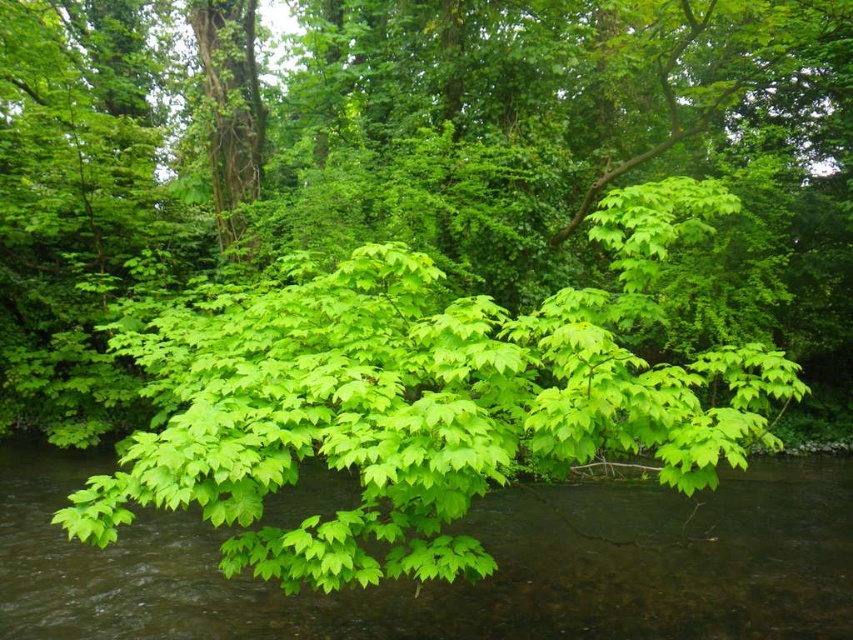
Question: Is the position of green leafy tree at center less distant than that of green matte leaf at center?

Choices:
 (A) no
 (B) yes

Answer: (A)

Question: Among these objects, which one is nearest to the camera?

Choices:
 (A) green matte leaf at center
 (B) green leafy branches at center
 (C) green leafy tree at center

Answer: (A)

Question: Considering the relative positions of green leafy tree at center and green leafy branches at center in the image provided, where is green leafy tree at center located with respect to green leafy branches at center?

Choices:
 (A) above
 (B) below

Answer: (A)

Question: Which point is closer to the camera?

Choices:
 (A) green leafy tree at center
 (B) green matte leaf at center
 (C) green leafy branches at center

Answer: (B)

Question: Based on their relative distances, which object is farther from the green leafy tree at center?

Choices:
 (A) green matte leaf at center
 (B) green leafy branches at center

Answer: (A)

Question: Does green leafy tree at center have a larger size compared to green leafy branches at center?

Choices:
 (A) no
 (B) yes

Answer: (B)